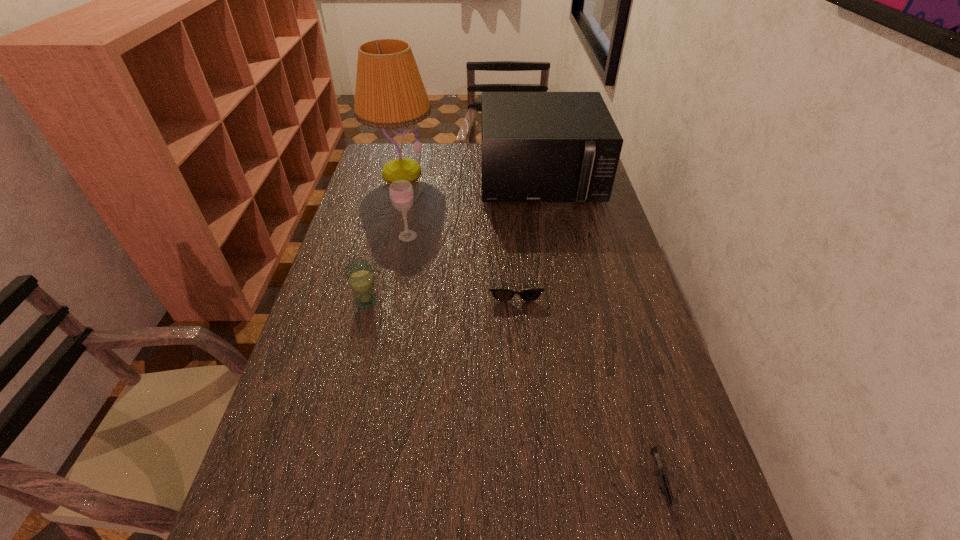
Where is `vacant region located 0.340m on the right of the glass`? The image size is (960, 540). vacant region located 0.340m on the right of the glass is located at coordinates (504, 301).

The height and width of the screenshot is (540, 960). I want to click on vacant region located 0.160m on the front lenses of the sunglasses, so click(x=520, y=350).

I want to click on lamp at the far edge, so click(389, 93).

Find the location of a particular element. Image resolution: width=960 pixels, height=540 pixels. microwave oven located in the far edge section of the desktop is located at coordinates (536, 146).

You are a GUI agent. You are given a task and a screenshot of the screen. Output one action in this format:
    pyautogui.click(x=<x>, y=<y>)
    Task: Click on the lamp at the left edge
    
    Given the screenshot: What is the action you would take?
    pyautogui.click(x=389, y=93)

Locate an element on the screen. glass positioned at the left edge is located at coordinates (359, 273).

The width and height of the screenshot is (960, 540). Find the location of `microwave oven present at the right edge`. microwave oven present at the right edge is located at coordinates (536, 146).

Image resolution: width=960 pixels, height=540 pixels. Find the location of `gun that is at the right edge`. gun that is at the right edge is located at coordinates (659, 470).

Where is `object situated at the far left corner`? This screenshot has width=960, height=540. object situated at the far left corner is located at coordinates (389, 93).

You are a GUI agent. You are given a task and a screenshot of the screen. Output one action in this format:
    pyautogui.click(x=<x>, y=<y>)
    Task: Click on the object situated at the far right corner
    
    Given the screenshot: What is the action you would take?
    pyautogui.click(x=536, y=146)